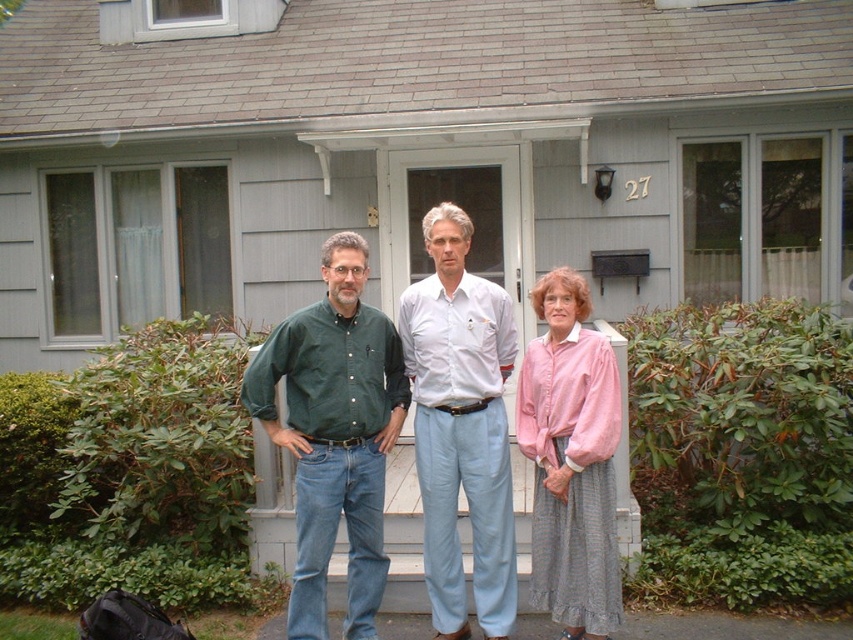
Question: Is green denim shirt at center below pink linen blouse at center?

Choices:
 (A) yes
 (B) no

Answer: (B)

Question: Can you confirm if green denim shirt at center is positioned below light blue cotton pants at center?

Choices:
 (A) no
 (B) yes

Answer: (B)

Question: From the image, what is the correct spatial relationship of green cotton shirt at center in relation to light blue cotton pants at center?

Choices:
 (A) left
 (B) right

Answer: (A)

Question: Based on their relative distances, which object is nearer to the pink linen blouse at center?

Choices:
 (A) green cotton shirt at center
 (B) green denim shirt at center

Answer: (A)

Question: Which of the following is the closest to the observer?

Choices:
 (A) (291, 618)
 (B) (558, 576)

Answer: (A)

Question: Which is nearer to the light blue cotton pants at center?

Choices:
 (A) green denim shirt at center
 (B) pink linen blouse at center

Answer: (B)